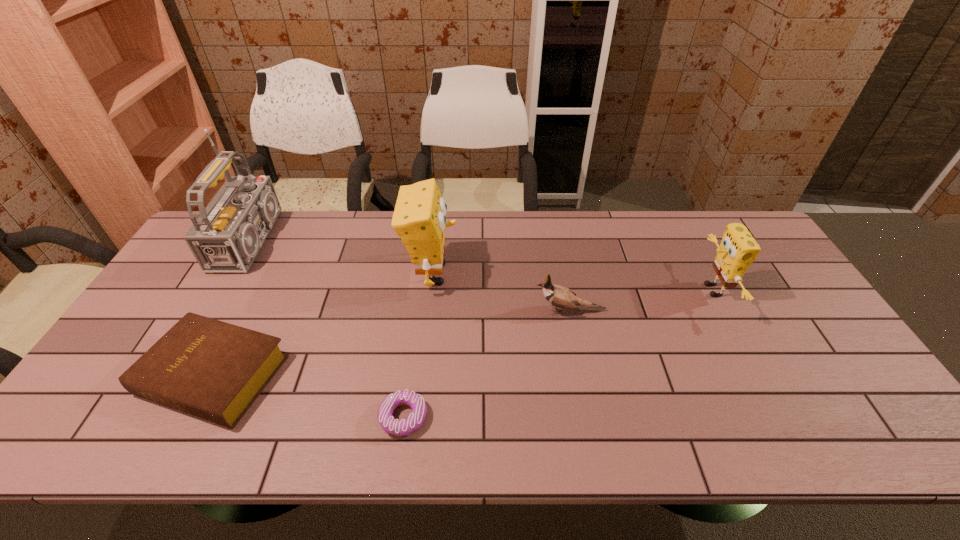
Where is `free region located 0.090m on the face of the left sponge`? free region located 0.090m on the face of the left sponge is located at coordinates (488, 273).

Locate an element on the screen. Image resolution: width=960 pixels, height=540 pixels. vacant space located 0.070m on the face of the fourth shortest object is located at coordinates (675, 291).

At what (x,y) coordinates should I click in order to perform the action: click on vacant space located on the face of the fourth shortest object. Please return your answer as a coordinate pair (x, y). The height and width of the screenshot is (540, 960). Looking at the image, I should click on (611, 291).

Where is `vacant space located on the face of the fourth shortest object`? This screenshot has width=960, height=540. vacant space located on the face of the fourth shortest object is located at coordinates (621, 291).

The image size is (960, 540). In order to click on free space located at the face of the fourth tallest object in this screenshot , I will do `click(393, 310)`.

The width and height of the screenshot is (960, 540). Identify the location of free space located at the face of the fourth tallest object. (494, 310).

The width and height of the screenshot is (960, 540). What are the coordinates of `vacant area situated 0.050m at the face of the fourth tallest object` in the screenshot? It's located at (516, 310).

Image resolution: width=960 pixels, height=540 pixels. I want to click on vacant space located 0.200m on the back of the second shortest object, so click(263, 279).

Image resolution: width=960 pixels, height=540 pixels. I want to click on free location located on the left of the shortest object, so point(305,417).

What are the coordinates of `radio receiver that is at the far edge` in the screenshot? It's located at (228, 234).